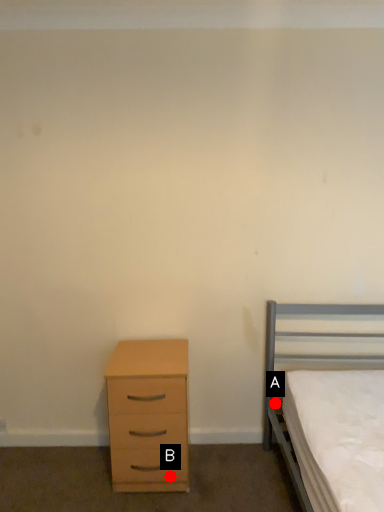
Question: Two points are circled on the image, labeled by A and B beside each circle. Which of the following is the farthest from the observer?

Choices:
 (A) A is further
 (B) B is further

Answer: (A)